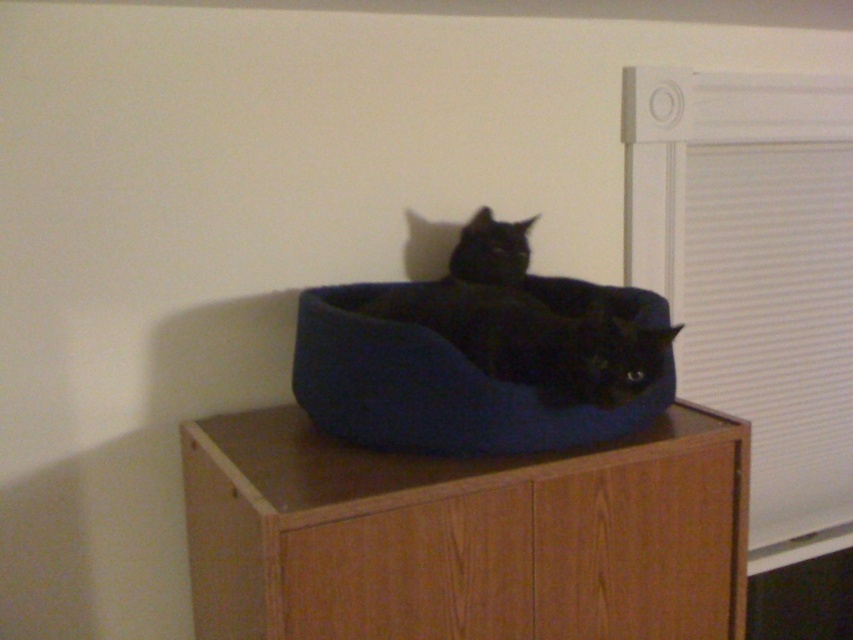
You are a photographer setting up a shot of the black cat in the blue pet bed. You want to ensure the black soft cushion at center and white fabric blinds at right are both visible in the frame. Which object should you adjust to make sure both are visible?

The black soft cushion at center is behind the white fabric blinds at right. To ensure both are visible, you should move the white fabric blinds at right to the side or adjust their position so they are not blocking the cushion.

You are a photographer setting up a shot of the black cat in the blue pet bed. You want to position a small lamp to the left of the black soft cushion at center so that it illuminates the cat without casting shadows from the white fabric blinds at right. Is this possible?

The white fabric blinds at right are to the right of the black soft cushion at center. Placing the lamp to the left of the black soft cushion at center would ensure the light comes from the opposite direction of the blinds, preventing their shadows from affecting the cat.